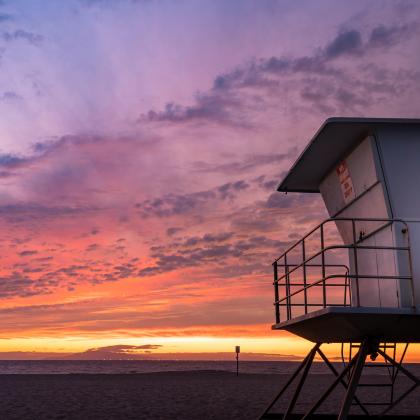
Identify the location of support beams. The image size is (420, 420). (350, 399), (295, 396), (340, 377), (408, 371).